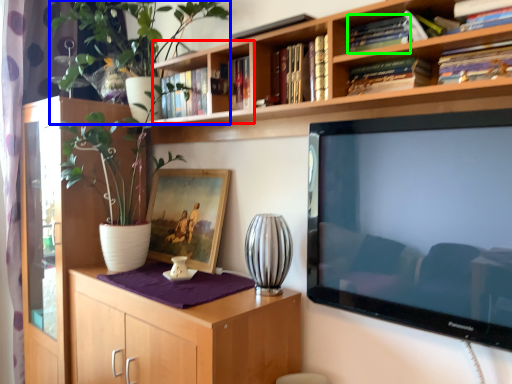
Question: Considering the real-world distances, which object is closest to shelf (highlighted by a red box)? plant (highlighted by a blue box) or book (highlighted by a green box).

Choices:
 (A) plant
 (B) book

Answer: (A)